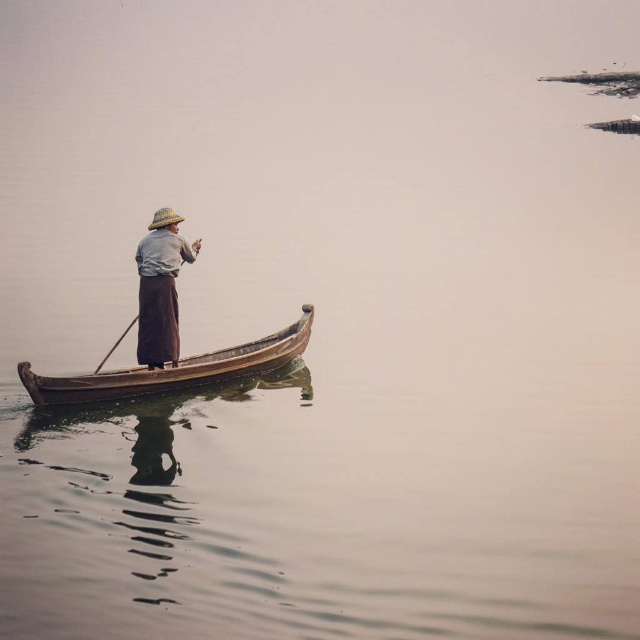
You are a photographer trying to capture the wooden canoe at center and the brown woven hat at center in a single shot. Based on their positions, which object should you focus on first to ensure both are in frame?

The wooden canoe at center is located below the brown woven hat at center, so you should focus on the brown woven hat at center first to ensure both are in frame.

You are an observer on the shore looking at the person in the boat. Which object at center is bigger in size between the brown woven hat at center and the wooden paddle at center?

The brown woven hat at center has a larger size compared to wooden paddle at center, so the brown woven hat at center is bigger in size.

In the scene shown: You are on a boat and want to grab the brown woven hat at center and the wooden paddle at center. Which object is closer to your right hand if you are facing forward?

The brown woven hat at center is to the right of wooden paddle at center, so it is closer to your right hand.